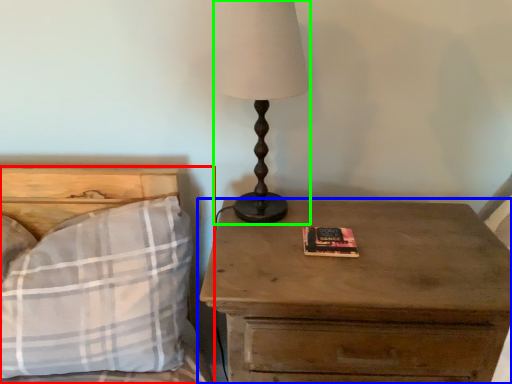
Question: Estimate the real-world distances between objects in this image. Which object is closer to bed (highlighted by a red box), nightstand (highlighted by a blue box) or table lamp (highlighted by a green box)?

Choices:
 (A) nightstand
 (B) table lamp

Answer: (B)